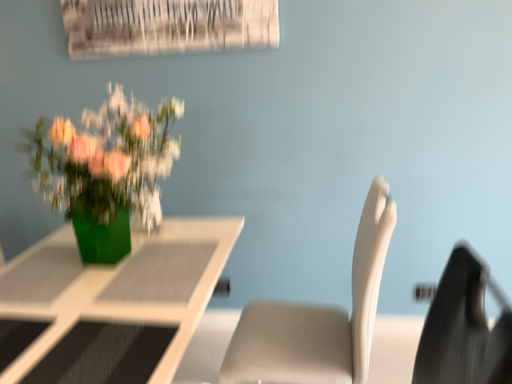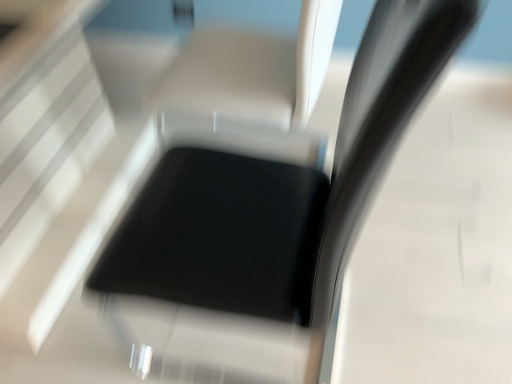
Question: How did the camera likely rotate when shooting the video?

Choices:
 (A) rotated downward
 (B) rotated upward

Answer: (A)